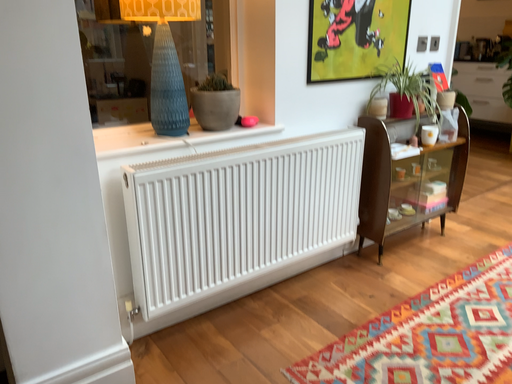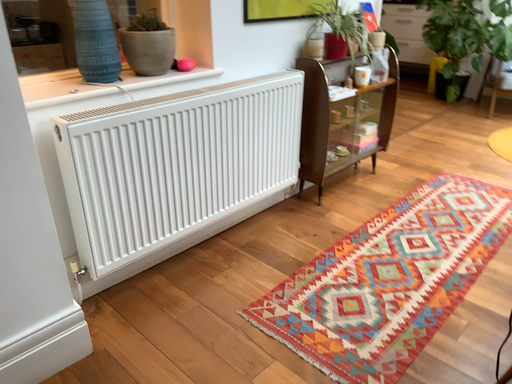
Question: Which way did the camera rotate in the video?

Choices:
 (A) rotated upward
 (B) rotated downward

Answer: (B)